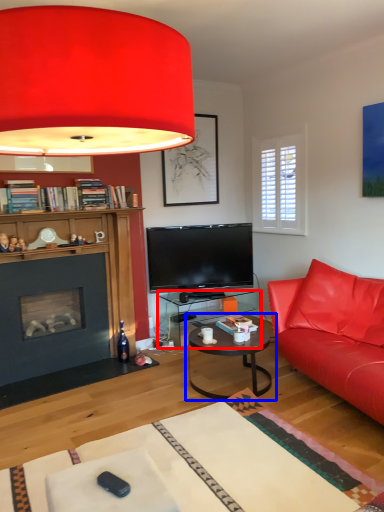
Question: Among these objects, which one is farthest to the camera, desk (highlighted by a red box) or coffee table (highlighted by a blue box)?

Choices:
 (A) desk
 (B) coffee table

Answer: (A)